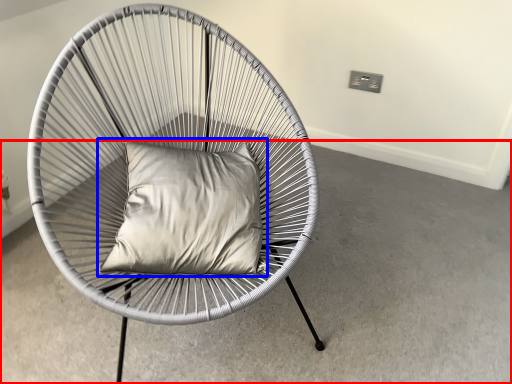
Question: Which point is further to the camera, concrete (highlighted by a red box) or pillow (highlighted by a blue box)?

Choices:
 (A) concrete
 (B) pillow

Answer: (B)